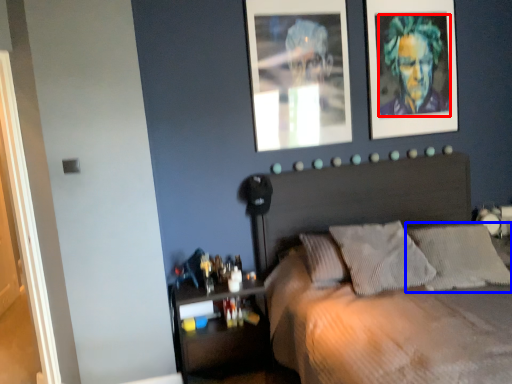
Question: Which object is closer to the camera taking this photo, person (highlighted by a red box) or pillow (highlighted by a blue box)?

Choices:
 (A) person
 (B) pillow

Answer: (B)